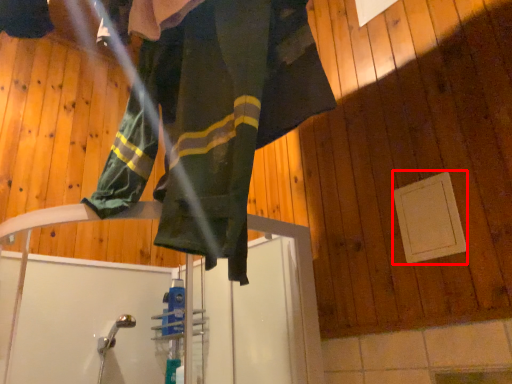
Question: Considering the relative positions of panel (annotated by the red box) and woman in the image provided, where is panel (annotated by the red box) located with respect to the staircase?

Choices:
 (A) right
 (B) left

Answer: (A)